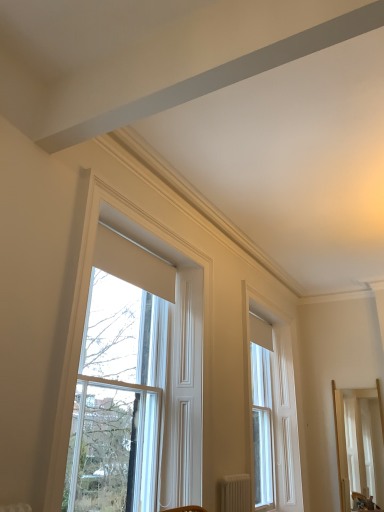
Question: From the image's perspective, is light wood mirror at right beneath white matte radiator at lower center?

Choices:
 (A) no
 (B) yes

Answer: (B)

Question: Is light wood mirror at right far away from white matte radiator at lower center?

Choices:
 (A) no
 (B) yes

Answer: (B)

Question: Is light wood mirror at right thinner than white matte radiator at lower center?

Choices:
 (A) no
 (B) yes

Answer: (A)

Question: Can you confirm if light wood mirror at right is taller than white matte radiator at lower center?

Choices:
 (A) no
 (B) yes

Answer: (B)

Question: Considering the relative positions of light wood mirror at right and white matte radiator at lower center in the image provided, is light wood mirror at right to the right of white matte radiator at lower center from the viewer's perspective?

Choices:
 (A) no
 (B) yes

Answer: (B)

Question: Are light wood mirror at right and white matte radiator at lower center beside each other?

Choices:
 (A) no
 (B) yes

Answer: (A)

Question: Can you confirm if white wood window at upper center, which is the second window in right-to-left order, is thinner than light wood mirror at right?

Choices:
 (A) yes
 (B) no

Answer: (A)

Question: Can you confirm if white wood window at upper center, which ranks as the first window in front-to-back order, is taller than light wood mirror at right?

Choices:
 (A) yes
 (B) no

Answer: (A)

Question: From the image's perspective, does white wood window at upper center, which ranks as the first window in left-to-right order, appear lower than light wood mirror at right?

Choices:
 (A) no
 (B) yes

Answer: (A)

Question: Is white wood window at upper center, arranged as the 2th window when viewed from the back, looking in the opposite direction of light wood mirror at right?

Choices:
 (A) no
 (B) yes

Answer: (A)

Question: Does white wood window at upper center, which ranks as the first window in front-to-back order, appear on the left side of light wood mirror at right?

Choices:
 (A) yes
 (B) no

Answer: (A)

Question: Is white wood window at upper center, arranged as the 2th window when viewed from the back, not within light wood mirror at right?

Choices:
 (A) no
 (B) yes

Answer: (B)

Question: Considering the relative sizes of light wood mirror at right and white wood window at center, positioned as the second window in left-to-right order, in the image provided, is light wood mirror at right bigger than white wood window at center, positioned as the second window in left-to-right order,?

Choices:
 (A) no
 (B) yes

Answer: (A)